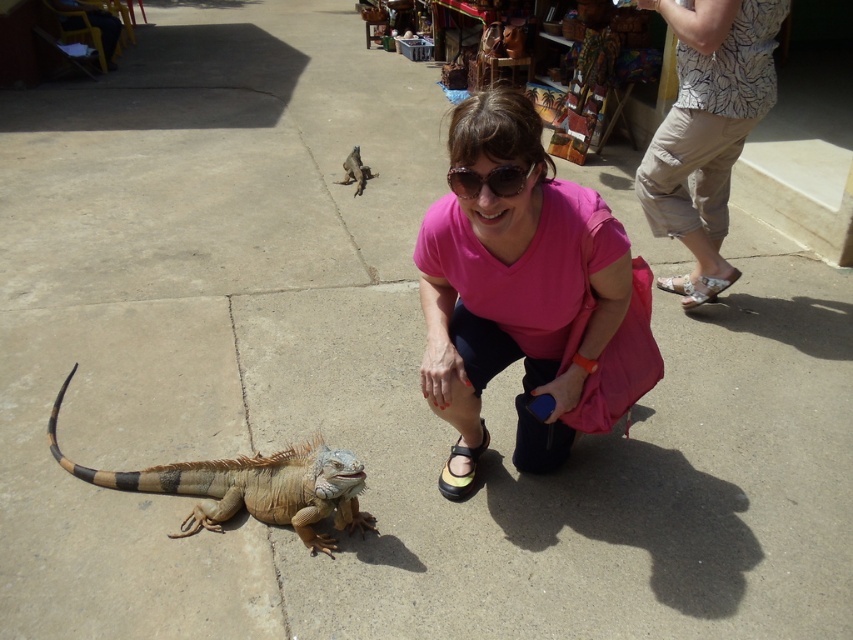
Question: Considering the real-world distances, which object is farthest from the brown scaly lizard at upper center?

Choices:
 (A) black synthetic sandal at lower center
 (B) beige scaly lizard at center

Answer: (A)

Question: Which of the following is the farthest from the observer?

Choices:
 (A) (357, 170)
 (B) (509, 180)
 (C) (485, 449)

Answer: (A)

Question: Can you confirm if pink fabric at center is thinner than printed cotton shirt at upper right?

Choices:
 (A) no
 (B) yes

Answer: (A)

Question: Is pink fabric at center above brown scaly lizard at upper center?

Choices:
 (A) yes
 (B) no

Answer: (B)

Question: Can you confirm if beige scaly lizard at center is bigger than black synthetic sandal at lower center?

Choices:
 (A) yes
 (B) no

Answer: (A)

Question: Which object appears closest to the camera in this image?

Choices:
 (A) printed cotton shirt at upper right
 (B) brown scaly lizard at upper center

Answer: (A)